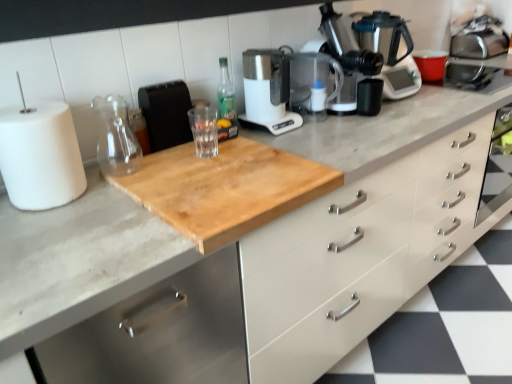
Measure the distance between point [362,98] and camera.

A distance of 5.33 feet exists between point [362,98] and camera.

The image size is (512, 384). What do you see at coordinates (226, 104) in the screenshot?
I see `green glass bottle at center` at bounding box center [226, 104].

Looking at this image, measure the distance between point (232, 105) and camera.

The depth of point (232, 105) is 1.61 meters.

Locate an element on the screen. Image resolution: width=512 pixels, height=384 pixels. transparent plastic blender at center, the second appliance when ordered from left to right is located at coordinates (312, 84).

Locate an element on the screen. The height and width of the screenshot is (384, 512). transparent glass jar at upper center, the 1th glass jar positioned from the left is located at coordinates (116, 137).

From a real-world perspective, is black textured toaster at upper center, placed as the 3th appliance when sorted from right to left, beneath natural wood cutting board at center?

Actually, black textured toaster at upper center, placed as the 3th appliance when sorted from right to left, is physically above natural wood cutting board at center in the real world.

Can you confirm if black textured toaster at upper center, placed as the 3th appliance when sorted from right to left, is wider than natural wood cutting board at center?

No, black textured toaster at upper center, placed as the 3th appliance when sorted from right to left, is not wider than natural wood cutting board at center.

Could you tell me if black textured toaster at upper center, placed as the 3th appliance when sorted from right to left, is turned towards natural wood cutting board at center?

No, black textured toaster at upper center, placed as the 3th appliance when sorted from right to left, is not aimed at natural wood cutting board at center.

There is a natural wood cutting board at center. Where is `the 1st appliance above it (from the image's perspective)`? The width and height of the screenshot is (512, 384). the 1st appliance above it (from the image's perspective) is located at coordinates (166, 113).

Considering the sizes of objects transparent glass at center, the first glass jar from the right, and white matte paper towel at left in the image provided, who is thinner, transparent glass at center, the first glass jar from the right, or white matte paper towel at left?

With smaller width is transparent glass at center, the first glass jar from the right.

From a real-world perspective, does transparent glass at center, the 2th glass jar when ordered from left to right, sit lower than white matte paper towel at left?

Indeed, from a real-world perspective, transparent glass at center, the 2th glass jar when ordered from left to right, is positioned beneath white matte paper towel at left.

Image resolution: width=512 pixels, height=384 pixels. Find the location of `the 2nd glass jar behind the white matte paper towel at left, starting your count from the anchor`. the 2nd glass jar behind the white matte paper towel at left, starting your count from the anchor is located at coordinates (204, 130).

From the image's perspective, is transparent glass at center, the 2th glass jar when ordered from left to right, positioned above or below white matte paper towel at left?

Clearly, from the image's perspective, transparent glass at center, the 2th glass jar when ordered from left to right, is above white matte paper towel at left.

Is black matte cup at center, which is the first appliance in right-to-left order, taller than transparent glass at center, the 2th glass jar when ordered from left to right?

Incorrect, the height of black matte cup at center, which is the first appliance in right-to-left order, is not larger of that of transparent glass at center, the 2th glass jar when ordered from left to right.

From a real-world perspective, who is located lower, black matte cup at center, which is counted as the 3th appliance, starting from the left, or transparent glass at center, the 2th glass jar when ordered from left to right?

black matte cup at center, which is counted as the 3th appliance, starting from the left, is physically lower.

This screenshot has width=512, height=384. I want to click on the 1st glass jar below the black matte cup at center, which is the first appliance in right-to-left order (from the image's perspective), so click(204, 130).

Considering the positions of objects satin silver coffee pot at upper right and transparent glass at center, the 2th glass jar when ordered from left to right, in the image provided, who is in front, satin silver coffee pot at upper right or transparent glass at center, the 2th glass jar when ordered from left to right,?

transparent glass at center, the 2th glass jar when ordered from left to right, is in front.

Would you say satin silver coffee pot at upper right contains transparent glass at center, the first glass jar from the right?

No, transparent glass at center, the first glass jar from the right, is not surrounded by satin silver coffee pot at upper right.

Consider the image. Which of these two, satin silver coffee pot at upper right or transparent glass at center, the 2th glass jar when ordered from left to right, is bigger?

satin silver coffee pot at upper right is bigger.

From the image's perspective, does satin silver coffee pot at upper right appear higher than transparent glass at center, the first glass jar from the right?

Indeed, from the image's perspective, satin silver coffee pot at upper right is shown above transparent glass at center, the first glass jar from the right.

Is transparent glass jar at upper center, which is counted as the second glass jar, starting from the right, facing away from transparent plastic blender at center, the second appliance positioned from the right?

No.

In the scene shown: Which object is more forward, transparent glass jar at upper center, the 1th glass jar positioned from the left, or transparent plastic blender at center, the second appliance positioned from the right?

transparent glass jar at upper center, the 1th glass jar positioned from the left, is in front.

From the image's perspective, is transparent glass jar at upper center, the 1th glass jar positioned from the left, positioned above or below transparent plastic blender at center, the second appliance when ordered from left to right?

Based on their image positions, transparent glass jar at upper center, the 1th glass jar positioned from the left, is located beneath transparent plastic blender at center, the second appliance when ordered from left to right.

You are a GUI agent. You are given a task and a screenshot of the screen. Output one action in this format:
    pyautogui.click(x=<x>, y=<y>)
    Task: Click on the coffeepot behind the green glass bottle at center
    This screenshot has width=512, height=384.
    Given the screenshot: What is the action you would take?
    pyautogui.click(x=390, y=51)

From a real-world perspective, which object stands above the other?

From a 3D spatial view, satin silver coffee pot at upper right is above.

Is satin silver coffee pot at upper right oriented towards green glass bottle at center?

No.

Looking at their sizes, would you say satin silver coffee pot at upper right is wider or thinner than green glass bottle at center?

Clearly, satin silver coffee pot at upper right has more width compared to green glass bottle at center.

Considering the relative sizes of white matte paper towel at left and transparent glass jar at upper center, which is counted as the second glass jar, starting from the right, in the image provided, is white matte paper towel at left bigger than transparent glass jar at upper center, which is counted as the second glass jar, starting from the right,?

Yes, white matte paper towel at left is bigger than transparent glass jar at upper center, which is counted as the second glass jar, starting from the right.

Measure the distance from white matte paper towel at left to transparent glass jar at upper center, which is counted as the second glass jar, starting from the right.

A distance of 7.62 inches exists between white matte paper towel at left and transparent glass jar at upper center, which is counted as the second glass jar, starting from the right.

Is white matte paper towel at left in front of or behind transparent glass jar at upper center, which is counted as the second glass jar, starting from the right, in the image?

Clearly, white matte paper towel at left is in front of transparent glass jar at upper center, which is counted as the second glass jar, starting from the right.

Is white matte paper towel at left facing towards transparent glass jar at upper center, the 1th glass jar positioned from the left?

No, white matte paper towel at left does not turn towards transparent glass jar at upper center, the 1th glass jar positioned from the left.

Which appliance is the 1st one when counting from the back of the natural wood cutting board at center? Please provide its 2D coordinates.

[(166, 113)]

The image size is (512, 384). I want to click on paper towel lying in front of the transparent glass at center, the first glass jar from the right, so click(x=40, y=156).

Considering their positions, is white matte paper towel at left positioned further to metallic silver coffee machine at upper right than white matte drawer at center?

white matte paper towel at left is further to metallic silver coffee machine at upper right.

Estimate the real-world distances between objects in this image. Which object is closer to natural wood cutting board at center, white matte paper towel at left or black textured toaster at upper center, placed as the 3th appliance when sorted from right to left?

white matte paper towel at left lies closer to natural wood cutting board at center than the other object.

Considering their positions, is natural wood cutting board at center positioned closer to metallic silver coffee machine at upper right than green glass bottle at center?

The object closer to metallic silver coffee machine at upper right is green glass bottle at center.

Estimate the real-world distances between objects in this image. Which object is further from black matte cup at center, which is counted as the 3th appliance, starting from the left, black textured toaster at upper center, the first appliance in the left-to-right sequence, or satin silver coffee pot at upper right?

black textured toaster at upper center, the first appliance in the left-to-right sequence, lies further to black matte cup at center, which is counted as the 3th appliance, starting from the left, than the other object.

Looking at this image, based on their spatial positions, is black textured toaster at upper center, the first appliance in the left-to-right sequence, or white matte paper towel at left further from transparent glass jar at upper center, which is counted as the second glass jar, starting from the right?

Based on the image, white matte paper towel at left appears to be further to transparent glass jar at upper center, which is counted as the second glass jar, starting from the right.

Estimate the real-world distances between objects in this image. Which object is further from metallic silver coffee machine at upper right, white plastic coffee maker at center or natural wood cutting board at center?

Based on the image, natural wood cutting board at center appears to be further to metallic silver coffee machine at upper right.

Based on their spatial positions, is natural wood cutting board at center or black matte cup at center, which is the first appliance in right-to-left order, further from transparent plastic blender at center, the second appliance when ordered from left to right?

natural wood cutting board at center is positioned further to the anchor transparent plastic blender at center, the second appliance when ordered from left to right.

Looking at the image, which one is located further to transparent plastic blender at center, the second appliance positioned from the right, black textured toaster at upper center, the first appliance in the left-to-right sequence, or satin silver coffee pot at upper right?

black textured toaster at upper center, the first appliance in the left-to-right sequence, is further to transparent plastic blender at center, the second appliance positioned from the right.

The width and height of the screenshot is (512, 384). Find the location of `appliance between green glass bottle at center and black matte cup at center, which is counted as the 3th appliance, starting from the left`. appliance between green glass bottle at center and black matte cup at center, which is counted as the 3th appliance, starting from the left is located at coordinates (312, 84).

The width and height of the screenshot is (512, 384). Identify the location of bottle positioned between natural wood cutting board at center and black matte cup at center, which is the first appliance in right-to-left order, from near to far. (226, 104).

This screenshot has height=384, width=512. What are the coordinates of `kitchen appliance between white matte paper towel at left and satin silver coffee pot at upper right from left to right` in the screenshot? It's located at (268, 90).

Identify the location of bottle between white matte paper towel at left and white matte drawer at center. The width and height of the screenshot is (512, 384). (226, 104).